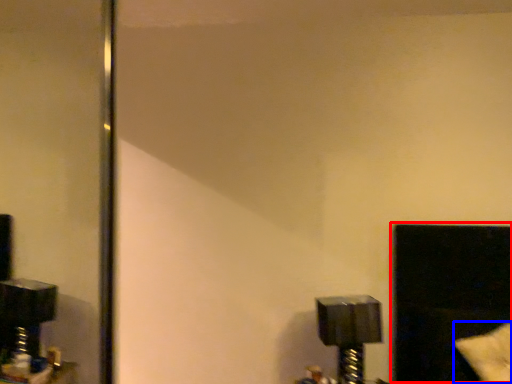
Question: Which of the following is the farthest to the observer, window (highlighted by a red box) or pillow (highlighted by a blue box)?

Choices:
 (A) window
 (B) pillow

Answer: (A)